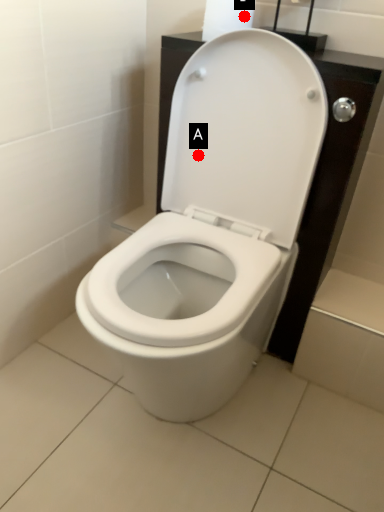
Question: Two points are circled on the image, labeled by A and B beside each circle. Which point is closer to the camera?

Choices:
 (A) A is closer
 (B) B is closer

Answer: (B)